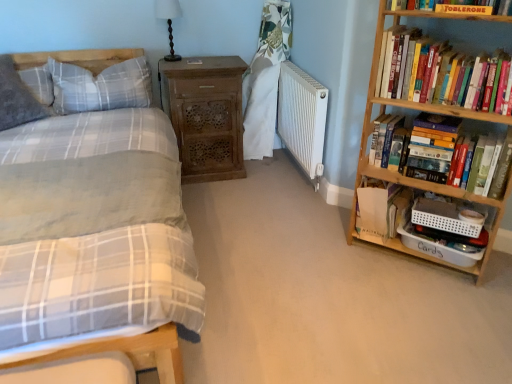
Find the location of a particular element. free space to the right of wooden carved nightstand at left is located at coordinates tap(265, 181).